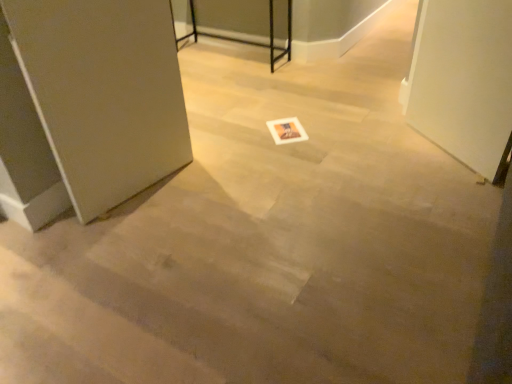
Question: Is white glossy screen door at right wider than white paper postcard at center?

Choices:
 (A) no
 (B) yes

Answer: (A)

Question: Is white glossy screen door at right aimed at white paper postcard at center?

Choices:
 (A) yes
 (B) no

Answer: (A)

Question: Is white glossy screen door at right at the right side of white paper postcard at center?

Choices:
 (A) no
 (B) yes

Answer: (B)

Question: Can you confirm if white glossy screen door at right is shorter than white paper postcard at center?

Choices:
 (A) no
 (B) yes

Answer: (A)

Question: Can you confirm if white glossy screen door at right is smaller than white paper postcard at center?

Choices:
 (A) no
 (B) yes

Answer: (A)

Question: Are white glossy screen door at right and white paper postcard at center making contact?

Choices:
 (A) no
 (B) yes

Answer: (A)

Question: Does metallic black table at upper center have a lesser width compared to satin silver door at left?

Choices:
 (A) yes
 (B) no

Answer: (B)

Question: Is metallic black table at upper center far away from satin silver door at left?

Choices:
 (A) yes
 (B) no

Answer: (A)

Question: Does metallic black table at upper center contain satin silver door at left?

Choices:
 (A) no
 (B) yes

Answer: (A)

Question: Does metallic black table at upper center lie in front of satin silver door at left?

Choices:
 (A) yes
 (B) no

Answer: (B)

Question: Can you confirm if metallic black table at upper center is wider than satin silver door at left?

Choices:
 (A) yes
 (B) no

Answer: (A)

Question: Is metallic black table at upper center oriented towards satin silver door at left?

Choices:
 (A) yes
 (B) no

Answer: (A)

Question: Considering the relative sizes of satin silver door at left and white glossy screen door at right in the image provided, is satin silver door at left wider than white glossy screen door at right?

Choices:
 (A) yes
 (B) no

Answer: (B)